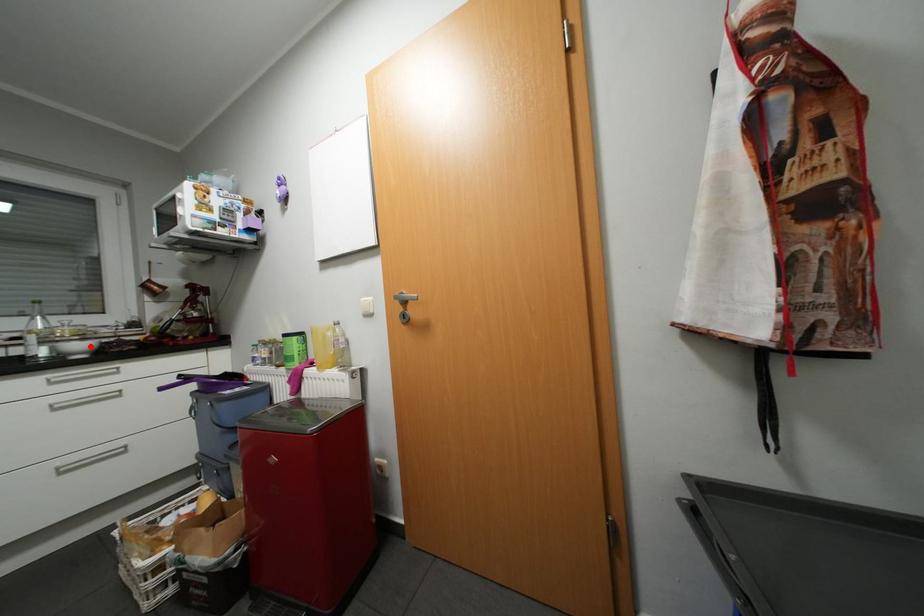
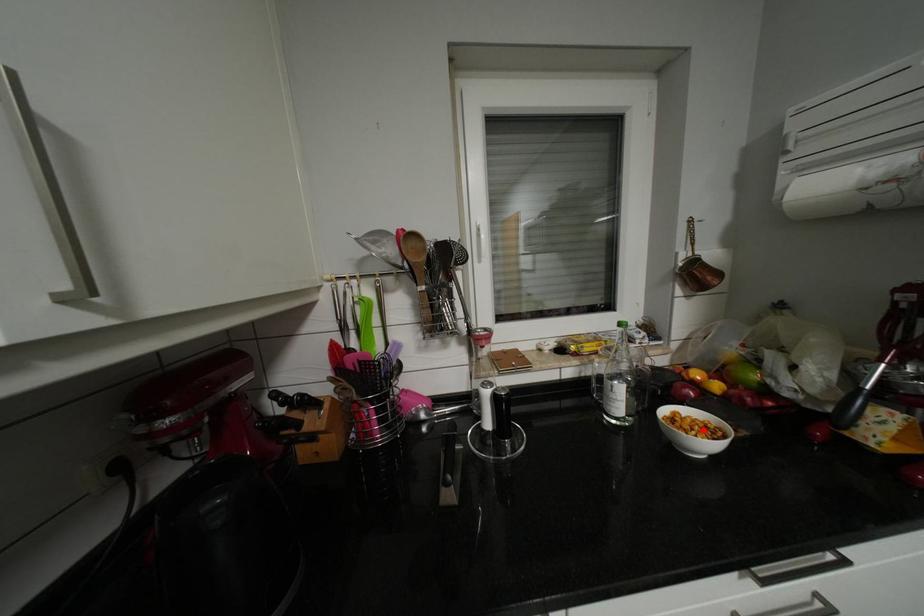
I am providing you with two images of the same scene from different viewpoints. A red point is marked on the first image and another point is marked on the second image. Are the points marked in image1 and image2 representing the same 3D position?

Yes